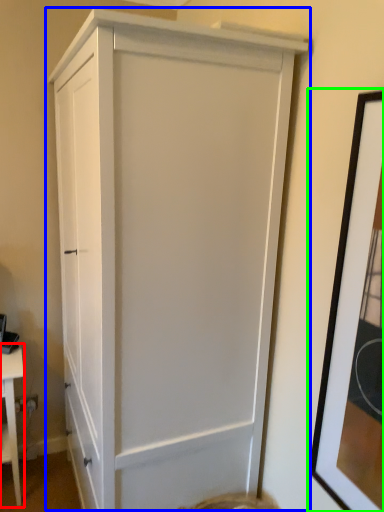
Question: Based on their relative distances, which object is nearer to table (highlighted by a red box)? Choose from cupboard (highlighted by a blue box) and picture frame (highlighted by a green box).

Choices:
 (A) cupboard
 (B) picture frame

Answer: (A)